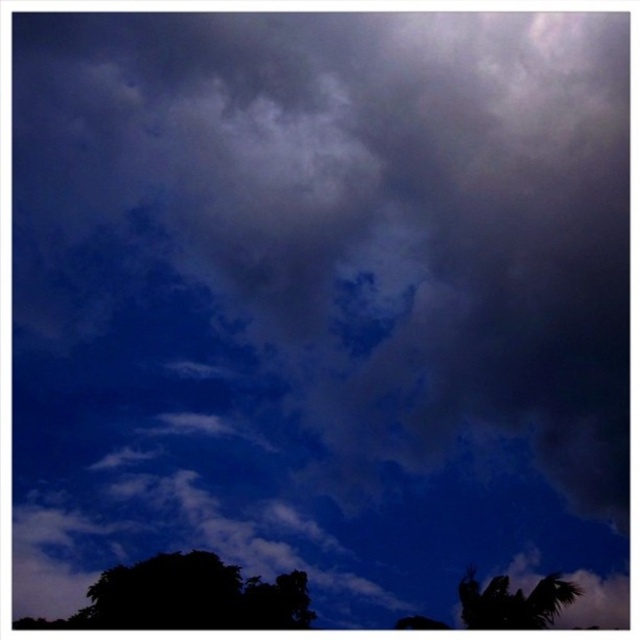
You are standing in a field looking at the sky. You see a silhouette leafy tree at lower left and a silhouette leafy palm at bottom right. Which tree is closer to the left edge of your view?

The silhouette leafy tree at lower left is closer to the left edge of your view because it is positioned on the left side of the silhouette leafy palm at bottom right.

You are an observer standing in the middle of the scene. You see the silhouette leafy tree at lower left and the silhouette leafy palm at bottom right. Which of these two trees has a greater width?

The silhouette leafy tree at lower left might be wider than the silhouette leafy palm at bottom right.